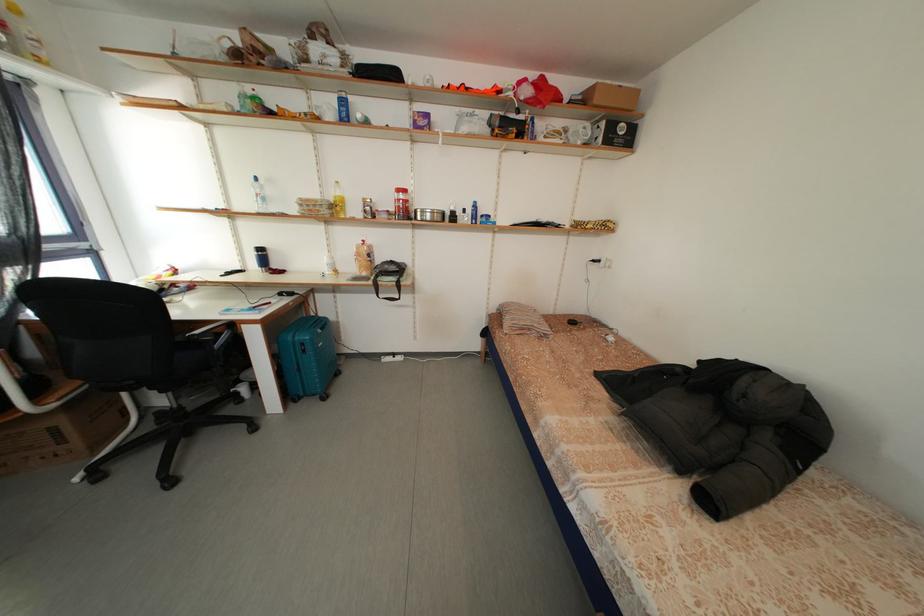
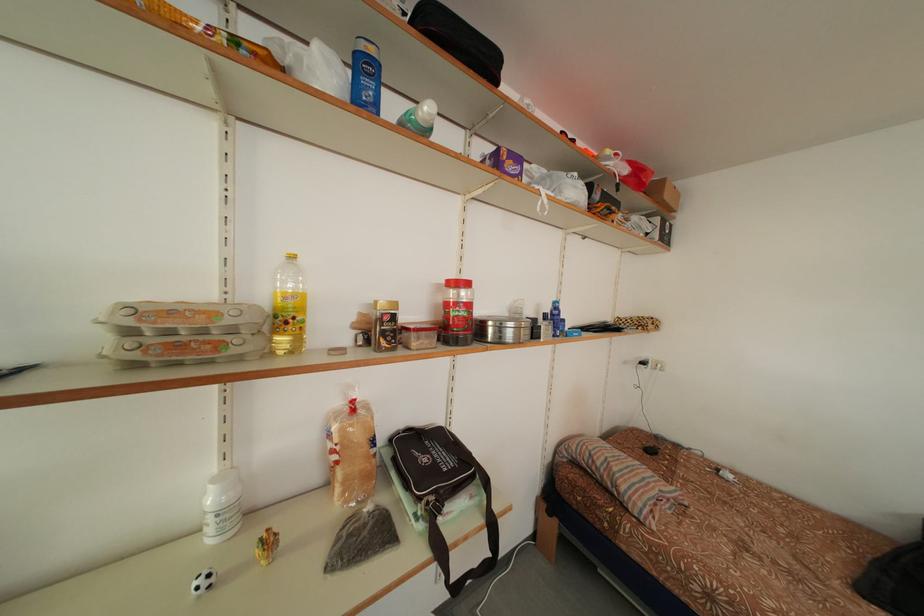
In the second image, find the point that corresponds to pixel 472 216 in the first image.

(553, 322)